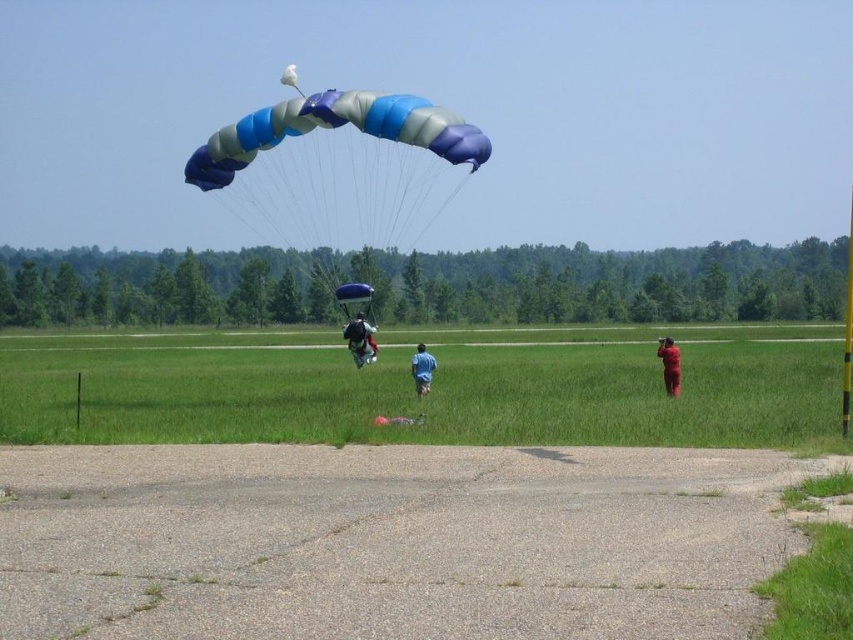
Is green grass at center in front of blue/white/grey fabric parachute at center?

Yes, it is.

Can you confirm if green grass at center is positioned to the left of blue/white/grey fabric parachute at center?

No, green grass at center is not to the left of blue/white/grey fabric parachute at center.

Which is behind, point (128, 435) or point (467, 136)?

Positioned behind is point (467, 136).

This screenshot has height=640, width=853. Find the location of `green grass at center`. green grass at center is located at coordinates pos(413,390).

Does green grass at center come in front of red fabric person at right?

Yes, green grass at center is in front of red fabric person at right.

Can you confirm if green grass at center is taller than red fabric person at right?

No.

Who is more forward, (271, 428) or (662, 364)?

Point (271, 428) is more forward.

Locate an element on the screen. The width and height of the screenshot is (853, 640). green grass at center is located at coordinates (413, 390).

Measure the distance between matte black backpack at center and camera.

The distance of matte black backpack at center from camera is 88.55 feet.

Is matte black backpack at center behind blue fabric parachute at center?

Yes, it is behind blue fabric parachute at center.

Identify the location of matte black backpack at center. The height and width of the screenshot is (640, 853). (360, 339).

Identify the location of matte black backpack at center. (360, 339).